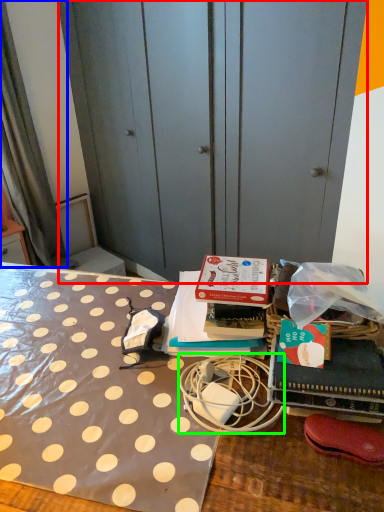
Question: Considering the real-world distances, which object is closest to dresser (highlighted by a red box)? curtain (highlighted by a blue box) or twin (highlighted by a green box).

Choices:
 (A) curtain
 (B) twin

Answer: (A)